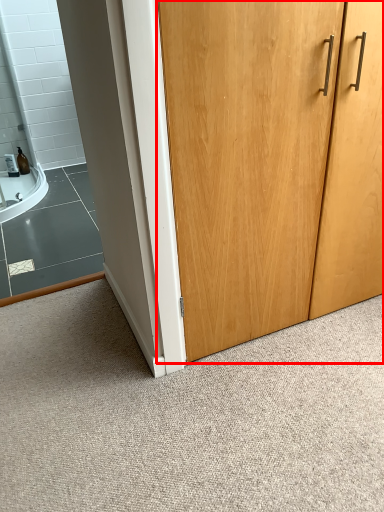
Question: From the image's perspective, what is the correct spatial relationship of door (annotated by the red box) in relation to granite?

Choices:
 (A) below
 (B) above

Answer: (B)